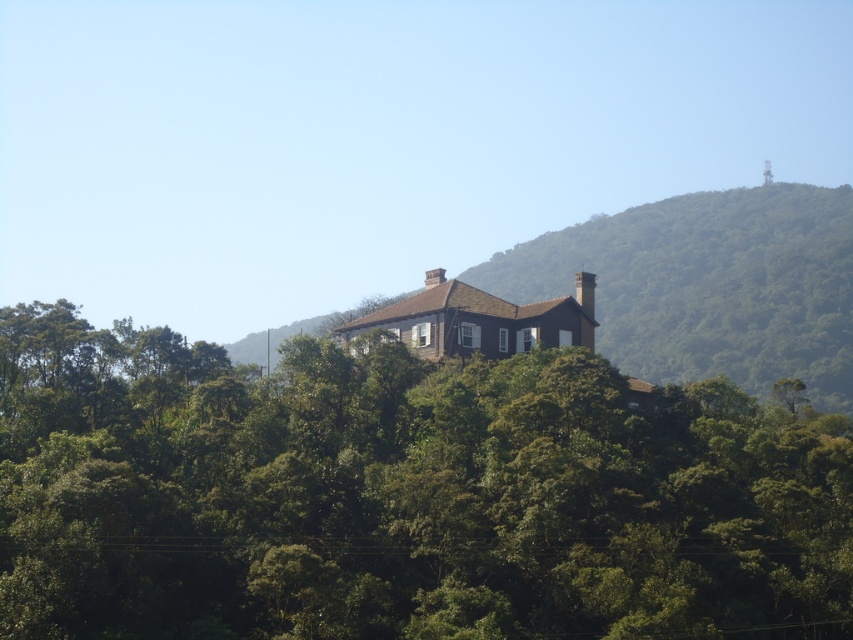
You are a visitor approaching the brown stone house at center and notice the green leafy tree at center nearby. Which one appears larger from your perspective?

The brown stone house at center appears larger than the green leafy tree at center because the tree is smaller in size compared to the house.

You are standing in the forest near the brown stone house at center. You want to see the top of the green leafy tree at center. Can you see it clearly from your current position?

The green leafy tree at center has a lesser height compared to brown stone house at center. Since the tree is shorter than the house, you might not be able to see its top clearly if the house obstructs your view.

Consider the image. You are standing in front of the house and notice two points marked on the image. The first point is at coordinates point (x=579, y=506) and the second is at point (x=241, y=353). Which point is closer to your current position?

Point (x=579, y=506) is closer to the camera than point (x=241, y=353), so the first point is closer to your current position.